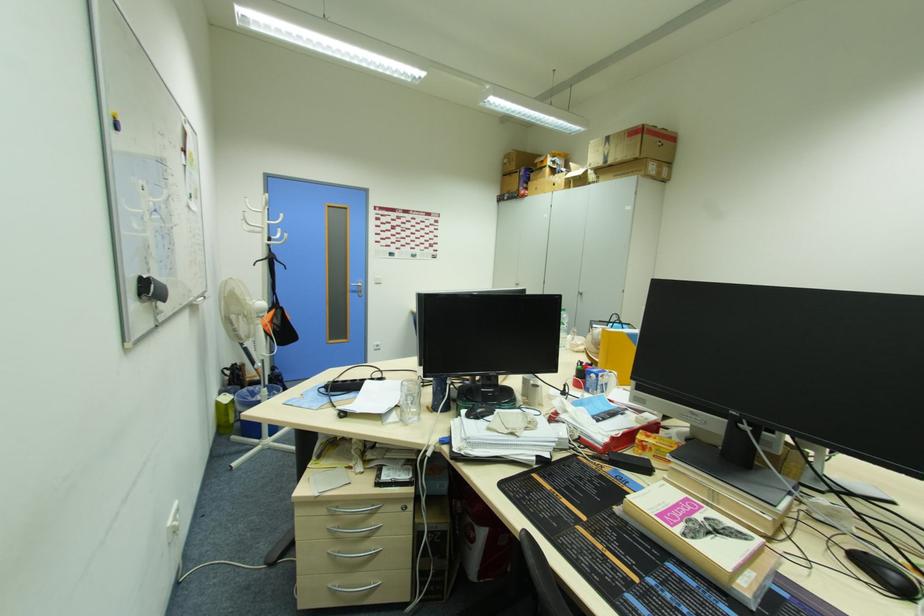
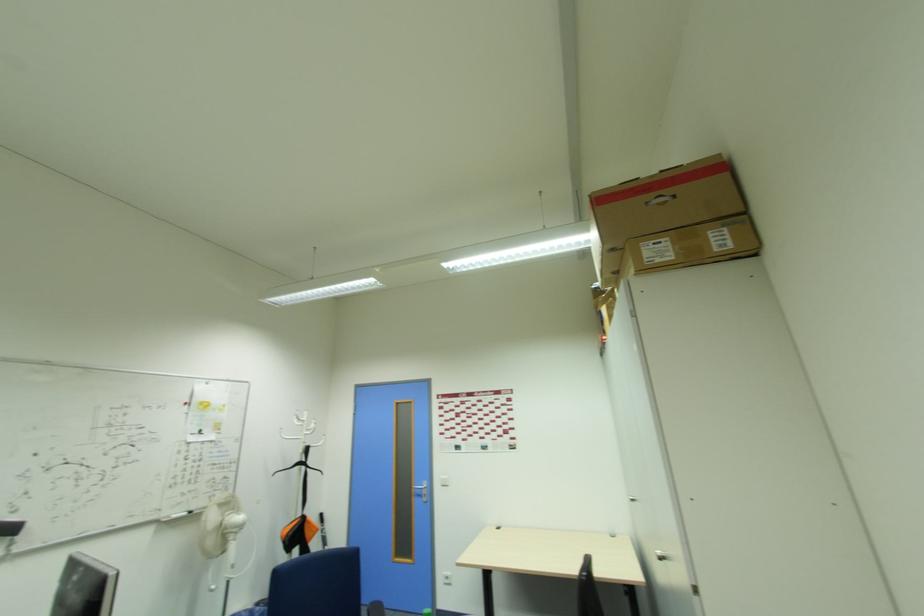
In the second image, find the point that corresponds to (x=665, y=131) in the first image.

(665, 172)